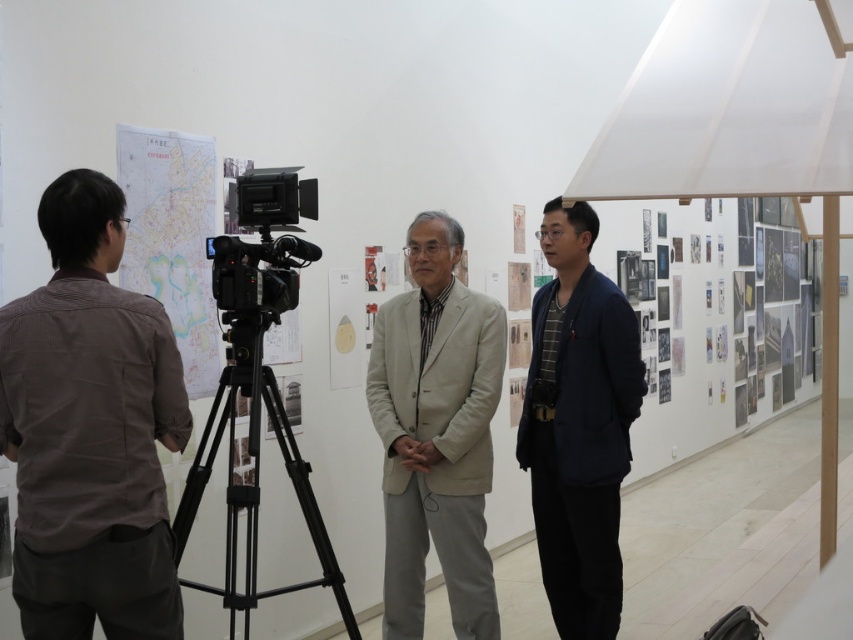
Does beige fabric suit at center have a greater width compared to black metal tripod at center?

No.

Which is below, beige fabric suit at center or black metal tripod at center?

black metal tripod at center is below.

At what (x,y) coordinates should I click in order to perform the action: click on beige fabric suit at center. Please return your answer as a coordinate pair (x, y). The height and width of the screenshot is (640, 853). Looking at the image, I should click on (436, 433).

Locate an element on the screen. Image resolution: width=853 pixels, height=640 pixels. beige fabric suit at center is located at coordinates pyautogui.click(x=436, y=433).

Can you confirm if dark blue suit at center is smaller than matte paper map at left?

No.

I want to click on dark blue suit at center, so click(579, 424).

Which is in front, point (86, 428) or point (543, 307)?

Point (86, 428)

Which is below, brown textured shirt at left or dark blue suit at center?

dark blue suit at center is lower down.

Does point (33, 460) come in front of point (604, 420)?

Yes.

Find the location of `brown textured shirt at left`. brown textured shirt at left is located at coordinates (90, 429).